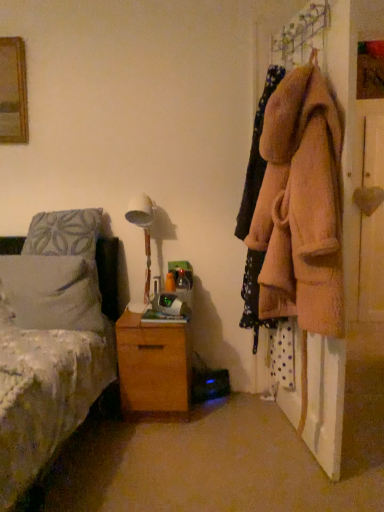
Where is `free point in front of wooden chest of drawers at lower center`? free point in front of wooden chest of drawers at lower center is located at coordinates (158, 450).